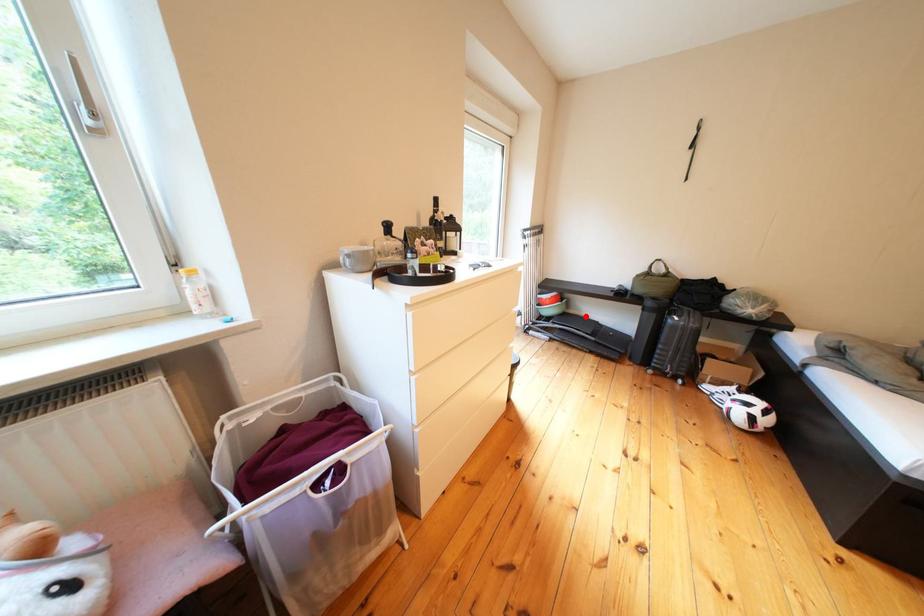
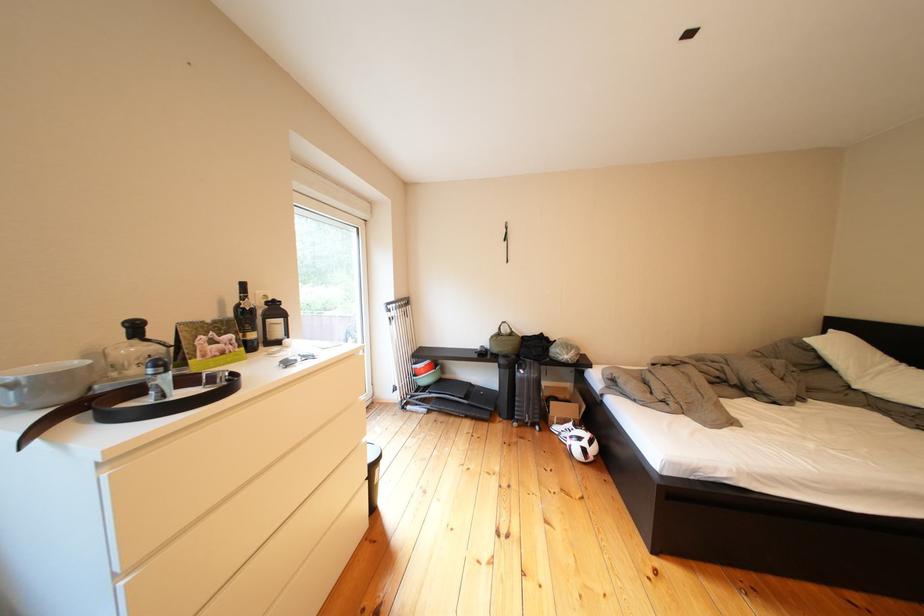
Where in the second image is the point corresponding to the highlighted location from the first image?

(462, 381)